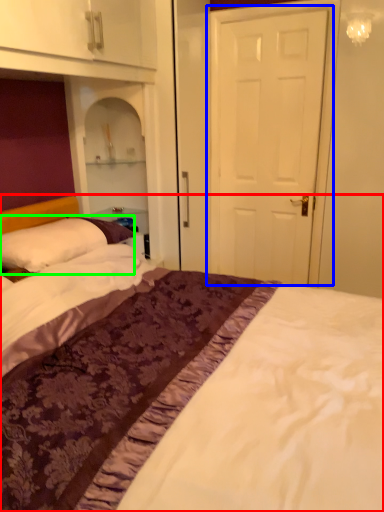
Question: Estimate the real-world distances between objects in this image. Which object is farther from bed (highlighted by a red box), door (highlighted by a blue box) or pillow (highlighted by a green box)?

Choices:
 (A) door
 (B) pillow

Answer: (A)